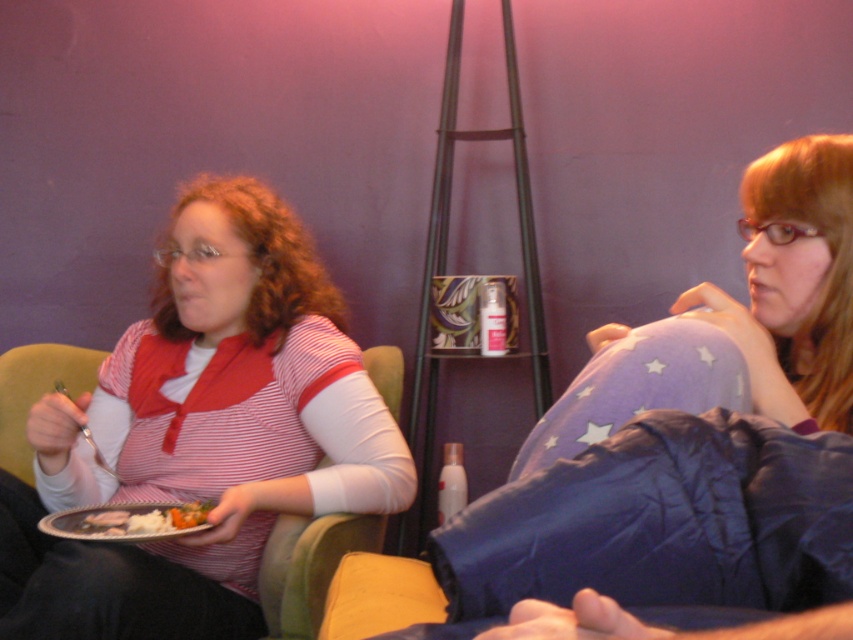
Consider the image. You are a delivery robot with a 10 inch long arm. You need to place a small package between the matte striped shirt at left and the white matte plate at lower left. Can your arm reach that space?

The distance between the matte striped shirt at left and the white matte plate at lower left is 8.66 inches, so the robot arm can reach the space between them since it is shorter than the arm length.

You are a photographer trying to capture a closeup of the white matte plate at lower left without including the matte striped shirt at left in the frame. Is this possible given their positions?

The matte striped shirt at left is in front of the white matte plate at lower left, so it would block the view. Therefore, it is not possible to capture a closeup of the white matte plate at lower left without including the matte striped shirt at left in the frame.